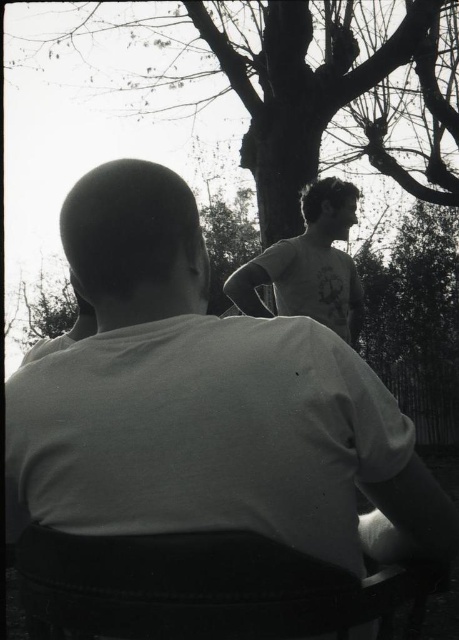
You are standing in the scene and want to place a small flag at the point closer to the camera between point (189, 97) and point (91, 608). Which point should you choose?

You should choose point (189, 97) because it is closer to the camera than point (91, 608).